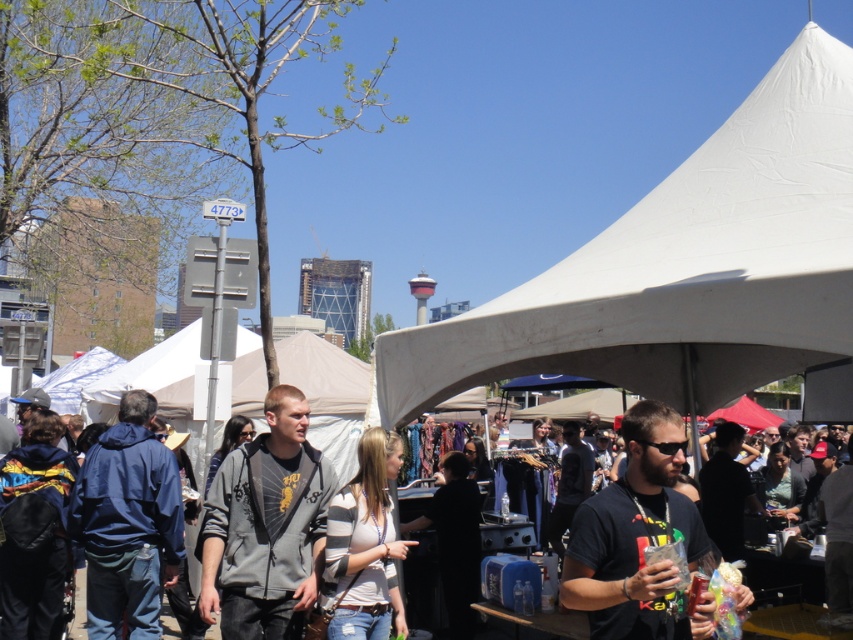
You are standing at the entrance of the outdoor market and want to reach a specific point marked at coordinates point (212,561). If you can walk 1.2 meters per second, how long will it take you to reach that point?

The distance of point (212,561) from viewer is 5.76 meters. At a walking speed of 1.2 meters per second, it will take approximately 4.8 seconds to reach the point.

You are a customer at the market and want to buy a jacket. You see the gray fleece jacket at center and the navy blue jacket at left. Which jacket is positioned higher in the frame?

The gray fleece jacket at center is located above the navy blue jacket at left, so it is positioned higher in the frame.